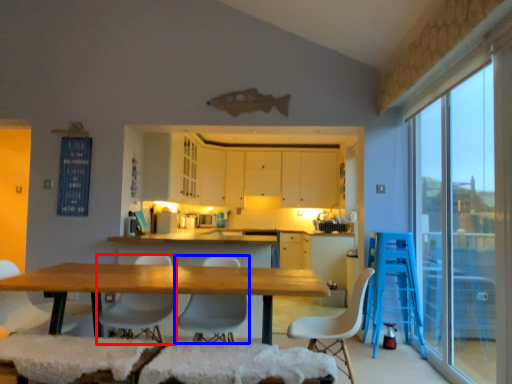
Question: Which of the following is the closest to the observer, chair (highlighted by a red box) or chair (highlighted by a blue box)?

Choices:
 (A) chair
 (B) chair

Answer: (B)